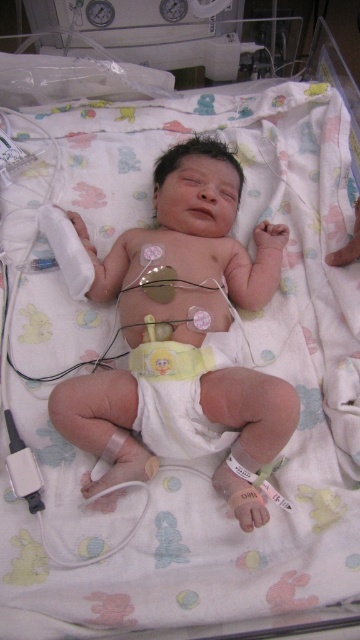
Question: Is white soft diaper at center to the left of teething ring at center from the viewer's perspective?

Choices:
 (A) yes
 (B) no

Answer: (A)

Question: Is smooth white diaper at center to the left of teething ring at center from the viewer's perspective?

Choices:
 (A) yes
 (B) no

Answer: (A)

Question: Which is farther from the smooth white diaper at center?

Choices:
 (A) white soft diaper at center
 (B) teething ring at center

Answer: (B)

Question: Among these objects, which one is nearest to the camera?

Choices:
 (A) smooth white diaper at center
 (B) teething ring at center

Answer: (A)

Question: Estimate the real-world distances between objects in this image. Which object is closer to the smooth white diaper at center?

Choices:
 (A) white soft diaper at center
 (B) teething ring at center

Answer: (A)

Question: Can you confirm if smooth white diaper at center is positioned to the right of white soft diaper at center?

Choices:
 (A) no
 (B) yes

Answer: (A)